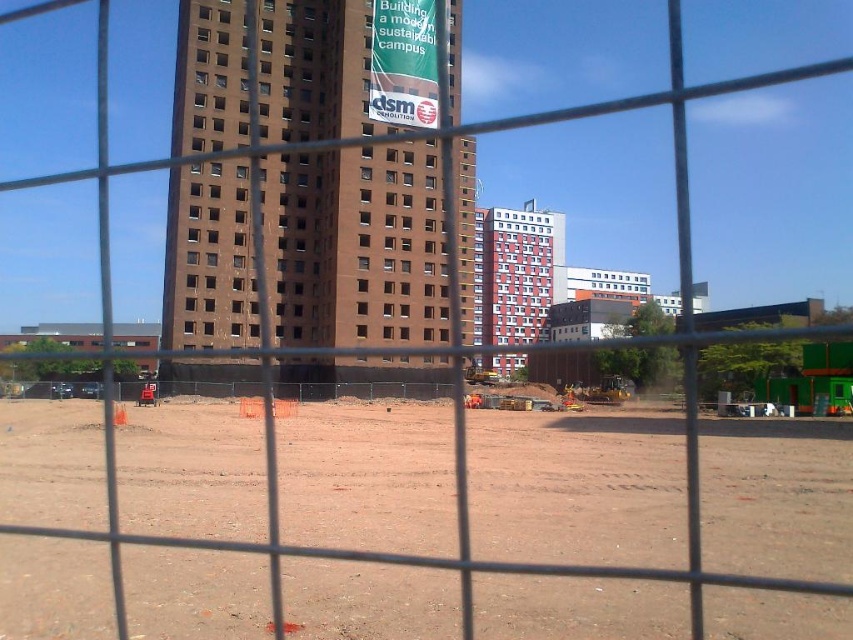
Question: Where is brown dirt field at center located in relation to brown brick building at center in the image?

Choices:
 (A) below
 (B) above

Answer: (A)

Question: Which point appears closest to the camera in this image?

Choices:
 (A) (392, 548)
 (B) (281, 64)

Answer: (A)

Question: Among these points, which one is farthest from the camera?

Choices:
 (A) (355, 209)
 (B) (815, 552)

Answer: (A)

Question: In this image, where is brown dirt field at center located relative to brown brick building at center?

Choices:
 (A) left
 (B) right

Answer: (B)

Question: Is brown dirt field at center positioned before brown brick building at center?

Choices:
 (A) yes
 (B) no

Answer: (A)